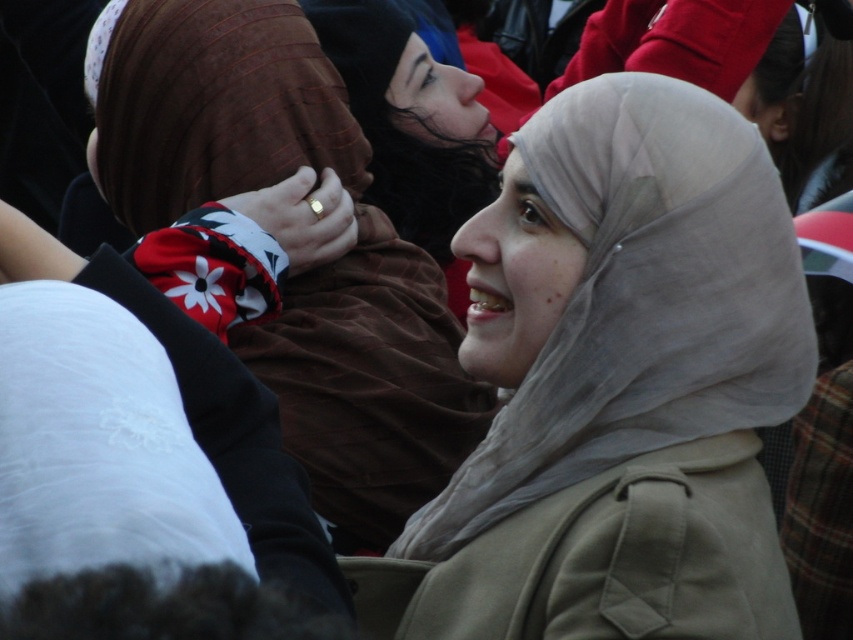
You are at a social gathering and want to take a photo of the light beige sheer at center and the matte brown scarf at center. Which one is covering the other?

The matte brown scarf at center is covering the light beige sheer at center because the light beige sheer at center is positioned under it.

What are the coordinates of the light beige sheer at center?

The light beige sheer at center is located at point (641, 300).